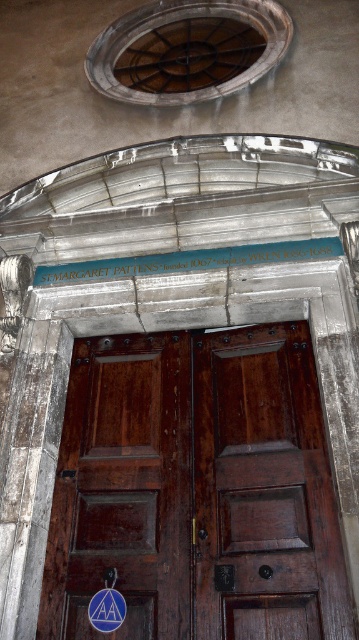
You are an architect examining the historic building entrance. You need to determine if the dark brown wood door at center can be seen entirely from the ground level without climbing. Considering the black stone inscription at center is positioned above it, can you confirm if the door is shorter than the inscription?

The dark brown wood door at center is much taller than the black stone inscription at center, so the door cannot be seen entirely from the ground level without climbing since it is taller than the inscription above it.

You are standing at the point marked as point (154, 372) and want to reach the entrance of the historic building. The entrance is located at the double wooden doors. Can you walk straight ahead to reach the doors without any obstacles?

The distance between point (154, 372) and the double wooden doors is 4.35 meters. Since there are no obstacles mentioned in the scene description, you can walk straight ahead to reach the doors.

You are standing in front of the historic building entrance. You notice two points marked on the image. The first point is at coordinates point [198,588] and the second is at point [58,268]. Which point is closer to you?

Point [198,588] is closer to the camera than point [58,268], so the first point is closer to you.